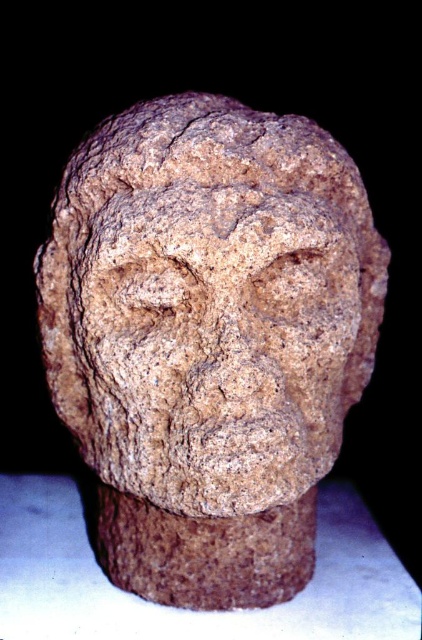
Which is above, brown rough stone head at center or rough stone face at center?

rough stone face at center is above.

Does point (189, 321) come closer to viewer compared to point (340, 308)?

That is True.

Where is `brown rough stone head at center`? This screenshot has height=640, width=422. brown rough stone head at center is located at coordinates (208, 339).